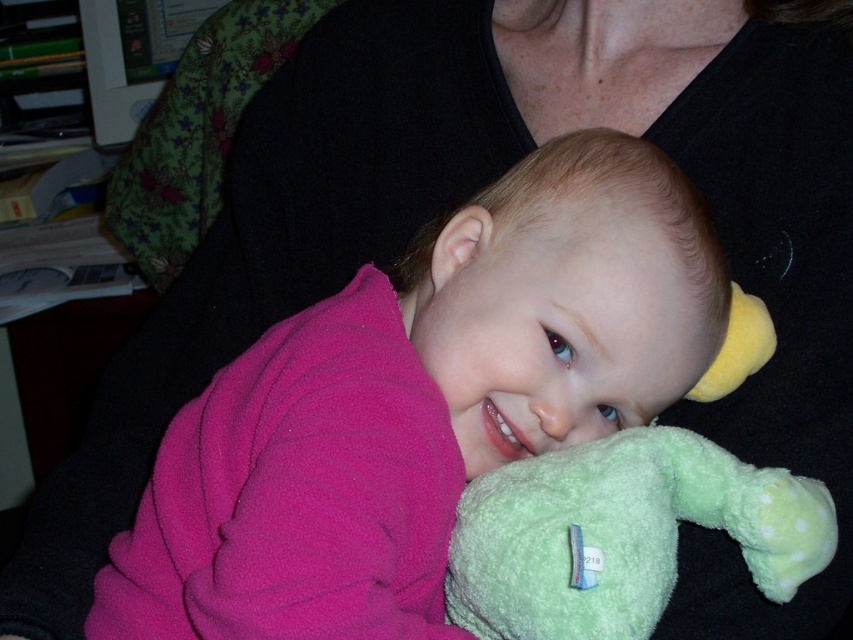
Does pink fleece baby at center appear on the right side of green plush toy at lower right?

No, pink fleece baby at center is not to the right of green plush toy at lower right.

Is point (372, 598) farther from camera compared to point (662, 582)?

No, it is not.

Locate an element on the screen. pink fleece baby at center is located at coordinates (419, 404).